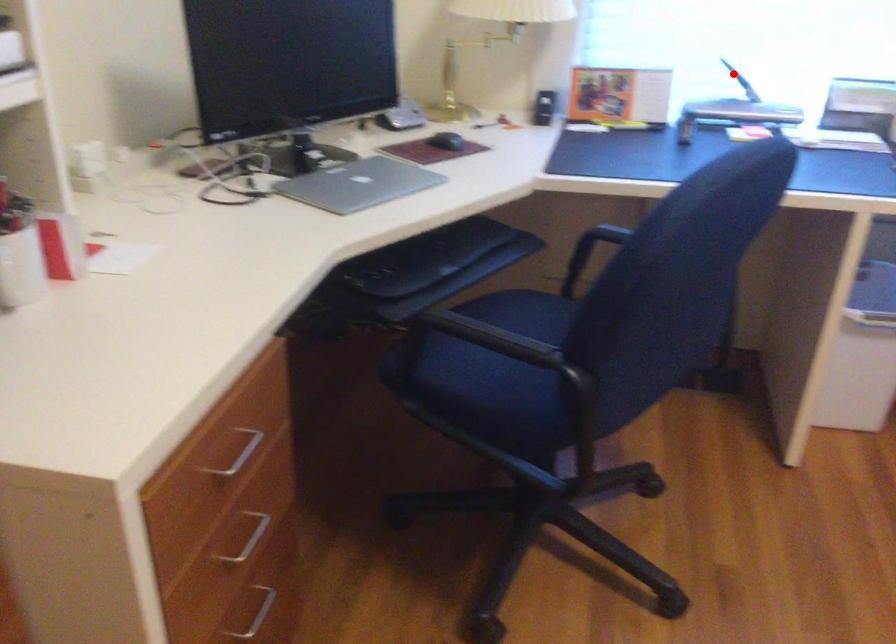
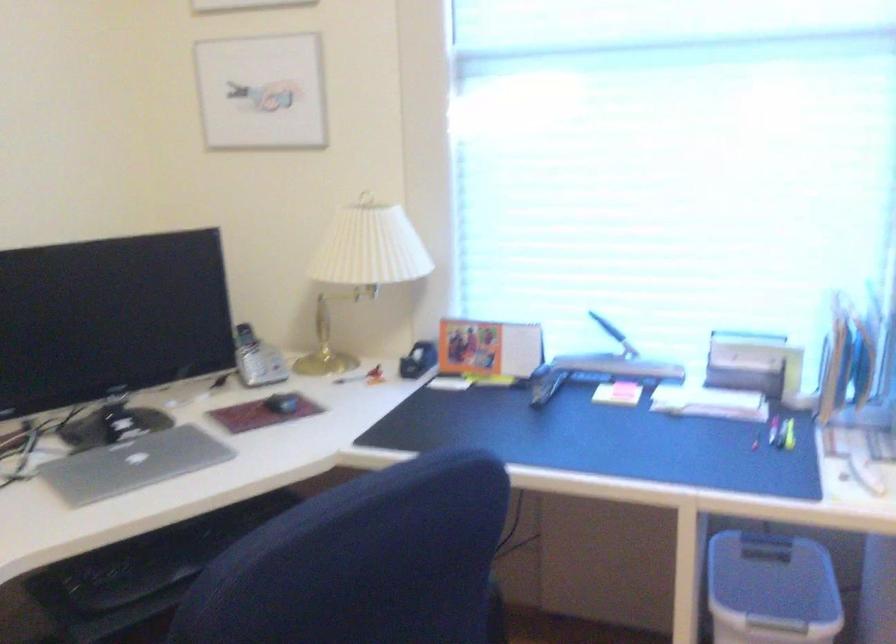
In the second image, find the point that corresponds to the highlighted location in the first image.

(607, 327)